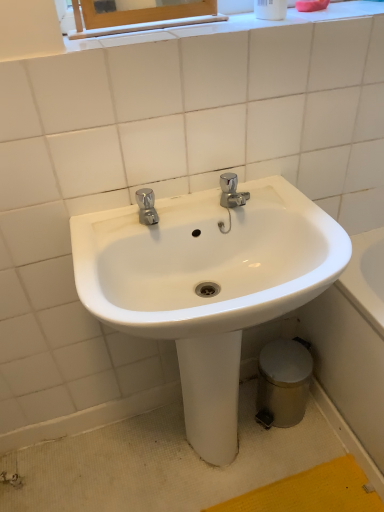
At what (x,y) coordinates should I click in order to perform the action: click on silver metallic trash can at lower right. Please return your answer as a coordinate pair (x, y). This screenshot has height=512, width=384. Looking at the image, I should click on (284, 381).

The width and height of the screenshot is (384, 512). What do you see at coordinates (284, 381) in the screenshot?
I see `silver metallic trash can at lower right` at bounding box center [284, 381].

This screenshot has width=384, height=512. Identify the location of white glossy sink at center. coord(207,285).

This screenshot has height=512, width=384. What do you see at coordinates (207, 285) in the screenshot? I see `white glossy sink at center` at bounding box center [207, 285].

Where is `silver metallic trash can at lower right`? This screenshot has height=512, width=384. silver metallic trash can at lower right is located at coordinates (284, 381).

Between white glossy sink at center and silver metallic trash can at lower right, which one appears on the left side from the viewer's perspective?

white glossy sink at center is more to the left.

Which object is further away from the camera taking this photo, white glossy sink at center or silver metallic trash can at lower right?

silver metallic trash can at lower right is behind.

Is point (230, 250) farther from camera compared to point (302, 409)?

That is False.

From the image's perspective, which one is positioned lower, white glossy sink at center or silver metallic trash can at lower right?

silver metallic trash can at lower right.

From a real-world perspective, is white glossy sink at center below silver metallic trash can at lower right?

Incorrect, from a real-world perspective, white glossy sink at center is higher than silver metallic trash can at lower right.

Can you confirm if white glossy sink at center is thinner than silver metallic trash can at lower right?

No, white glossy sink at center is not thinner than silver metallic trash can at lower right.

Can you confirm if white glossy sink at center is shorter than silver metallic trash can at lower right?

No.

Is white glossy sink at center bigger than silver metallic trash can at lower right?

Indeed, white glossy sink at center has a larger size compared to silver metallic trash can at lower right.

In the scene shown: Can we say white glossy sink at center lies outside silver metallic trash can at lower right?

Yes, white glossy sink at center is outside of silver metallic trash can at lower right.

Is white glossy sink at center with silver metallic trash can at lower right?

No, white glossy sink at center is not with silver metallic trash can at lower right.

Could you tell me if white glossy sink at center is turned towards silver metallic trash can at lower right?

No, white glossy sink at center does not turn towards silver metallic trash can at lower right.

Can you tell me how much white glossy sink at center and silver metallic trash can at lower right differ in facing direction?

The angular difference between white glossy sink at center and silver metallic trash can at lower right is 2.17 degrees.

This screenshot has height=512, width=384. What are the coordinates of `bidet behind the white glossy sink at center` in the screenshot? It's located at (284, 381).

Is silver metallic trash can at lower right to the left or to the right of white glossy sink at center in the image?

Based on their positions, silver metallic trash can at lower right is located to the right of white glossy sink at center.

Consider the image. Which object is further away from the camera taking this photo, silver metallic trash can at lower right or white glossy sink at center?

Positioned behind is silver metallic trash can at lower right.

Is point (307, 397) positioned after point (218, 285)?

That is True.

From the image's perspective, which one is positioned higher, silver metallic trash can at lower right or white glossy sink at center?

white glossy sink at center is shown above in the image.

From a real-world perspective, which object stands above the other?

white glossy sink at center is physically above.

Considering the relative sizes of silver metallic trash can at lower right and white glossy sink at center in the image provided, is silver metallic trash can at lower right thinner than white glossy sink at center?

Yes, silver metallic trash can at lower right is thinner than white glossy sink at center.

From their relative heights in the image, would you say silver metallic trash can at lower right is taller or shorter than white glossy sink at center?

In the image, silver metallic trash can at lower right appears to be shorter than white glossy sink at center.

Considering the sizes of silver metallic trash can at lower right and white glossy sink at center in the image, is silver metallic trash can at lower right bigger or smaller than white glossy sink at center?

In the image, silver metallic trash can at lower right appears to be smaller than white glossy sink at center.

Is silver metallic trash can at lower right completely or partially outside of white glossy sink at center?

No, silver metallic trash can at lower right is not outside of white glossy sink at center.

Would you consider silver metallic trash can at lower right to be distant from white glossy sink at center?

No, silver metallic trash can at lower right is in close proximity to white glossy sink at center.

Could you tell me if silver metallic trash can at lower right is facing white glossy sink at center?

Yes, silver metallic trash can at lower right is facing white glossy sink at center.

Find the location of a particular element. bidet below the white glossy sink at center (from the image's perspective) is located at coordinates pyautogui.click(x=284, y=381).

Image resolution: width=384 pixels, height=512 pixels. Identify the location of sink above the silver metallic trash can at lower right (from the image's perspective). (207, 285).

In the image, there is a white glossy sink at center. Where is `bidet below it (from a real-world perspective)`? This screenshot has width=384, height=512. bidet below it (from a real-world perspective) is located at coordinates (284, 381).